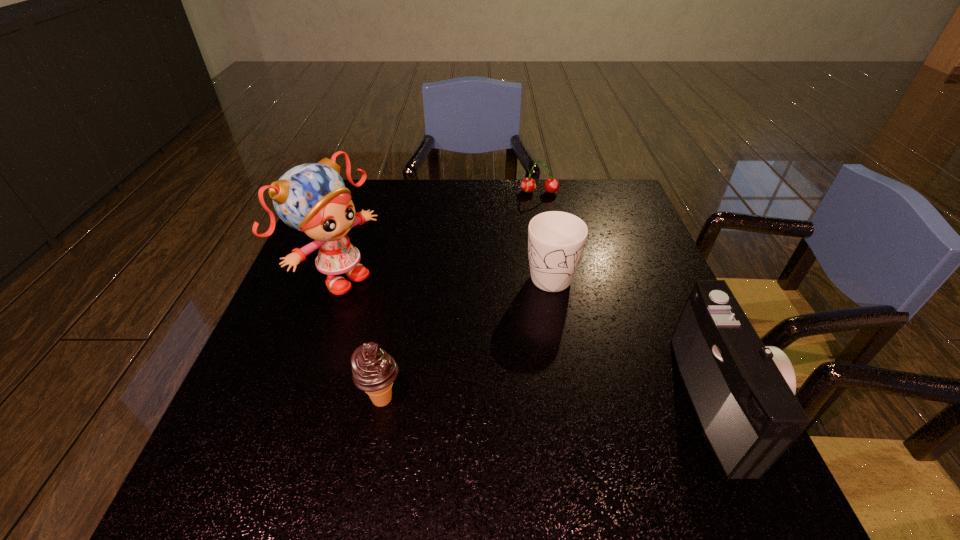
The height and width of the screenshot is (540, 960). In order to click on vacant region that satisfies the following two spatial constraints: 1. on the back side of the mug; 2. on the left side of the farthest object in this screenshot , I will do `click(536, 192)`.

Locate an element on the screen. free location that satisfies the following two spatial constraints: 1. on the back side of the leftmost object; 2. on the right side of the mug is located at coordinates (341, 273).

Image resolution: width=960 pixels, height=540 pixels. What are the coordinates of `free space that satisfies the following two spatial constraints: 1. on the front side of the rightmost object; 2. on the lens of the mug` in the screenshot? It's located at (572, 400).

Find the location of a particular element. vacant space that satisfies the following two spatial constraints: 1. on the front side of the shortest object; 2. on the lens of the camcorder is located at coordinates (579, 400).